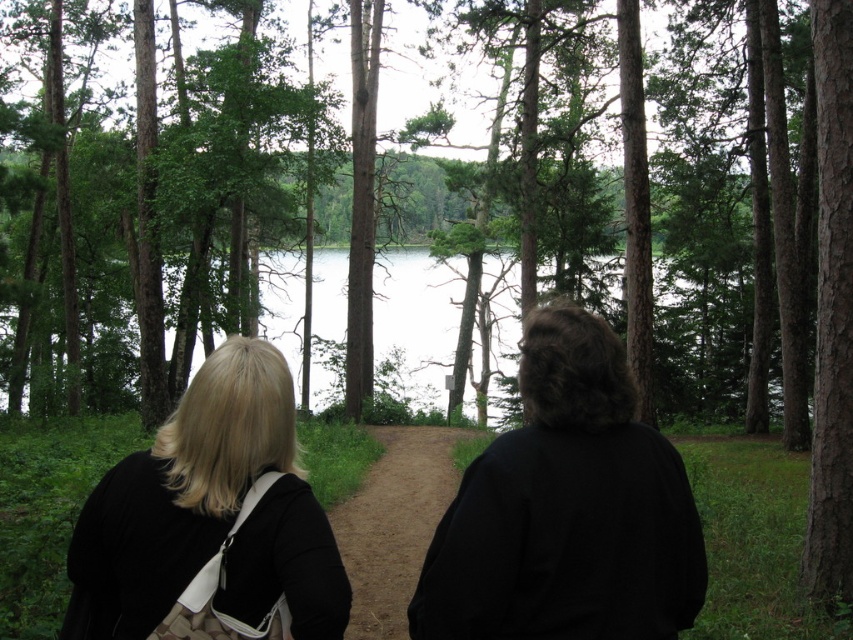
You are a hiker trying to locate the blonde hair at center and the brown textured tree at center in the forest. Which object is closer to you?

The brown textured tree at center is closer to you than the blonde hair at center.

You are a hiker trying to determine the elevation difference between the blonde hair at center and the clear water at center. Which object is lower in elevation?

The blonde hair at center has a lesser height compared to clear water at center, so the blonde hair at center is lower in elevation.